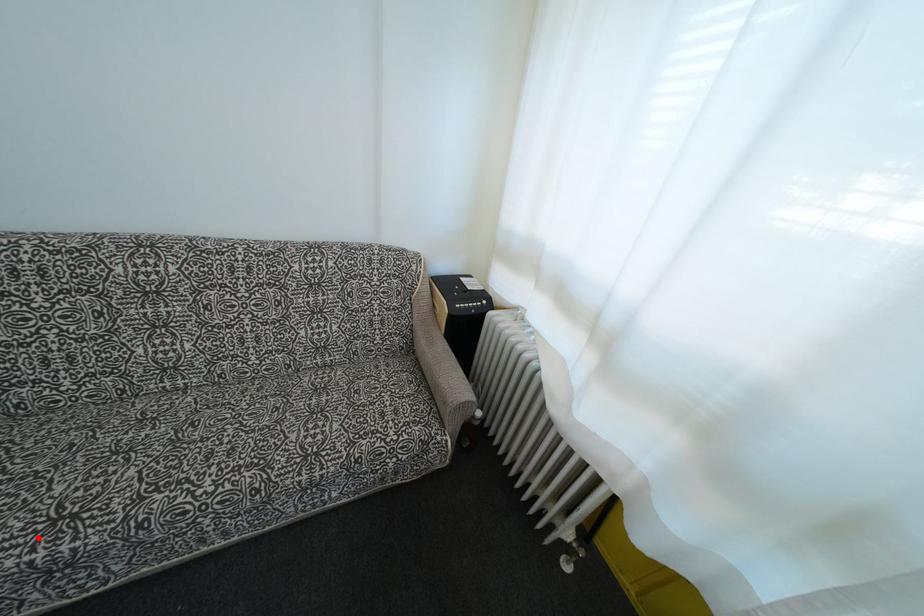
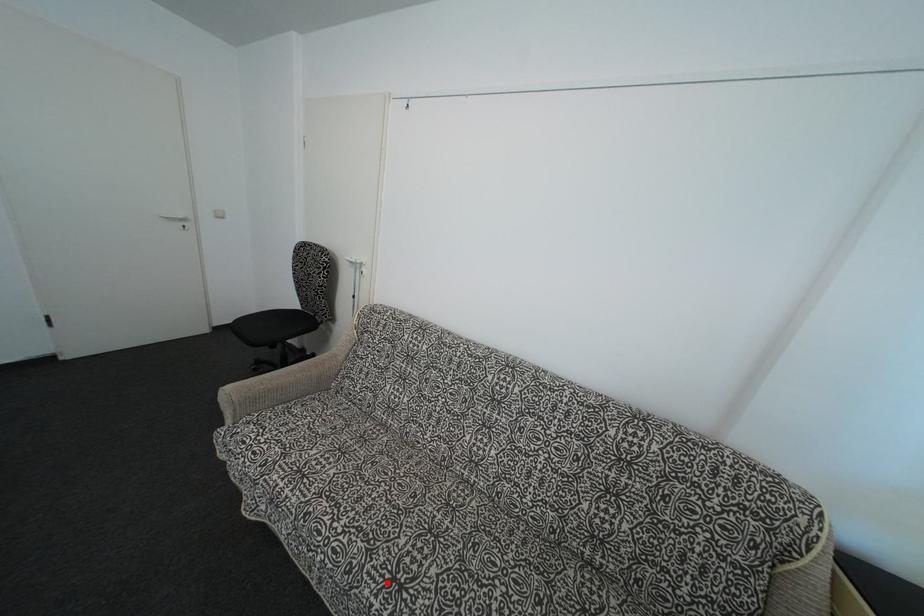
I am providing you with two images of the same scene from different viewpoints. A red point is marked on the first image and another point is marked on the second image. Do the highlighted points in image1 and image2 indicate the same real-world spot?

Yes